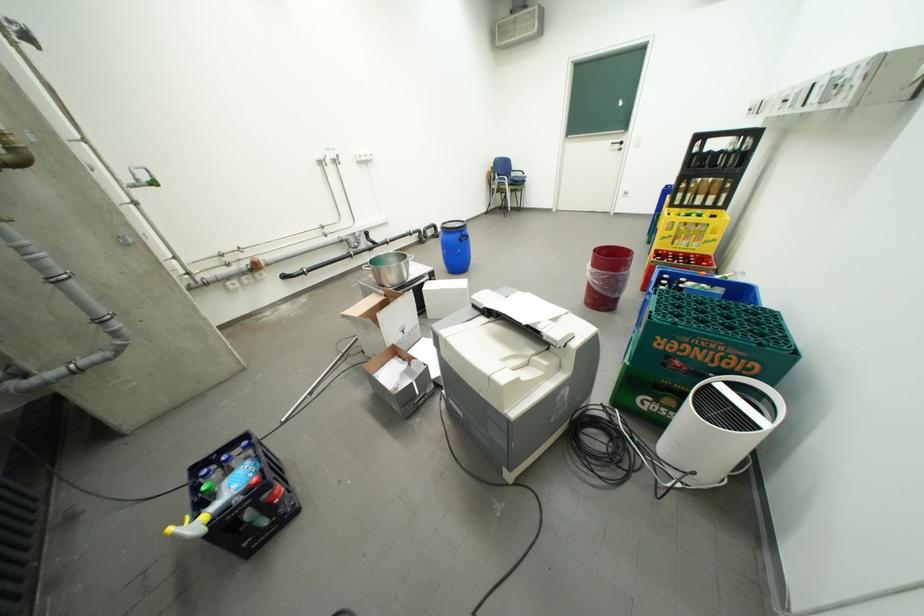
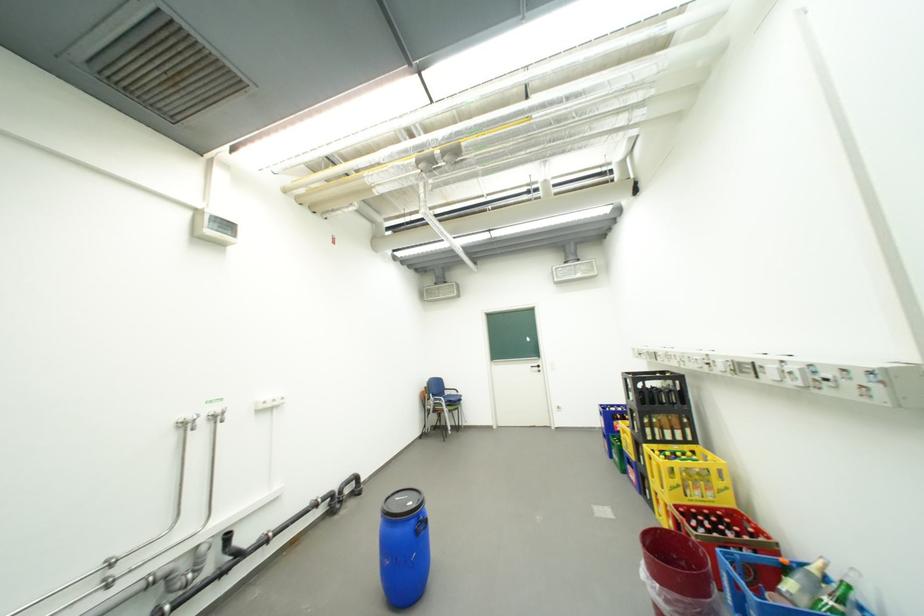
The images are taken continuously from a first-person perspective. In which direction is your viewpoint rotating?

The camera's rotation is toward right-up.